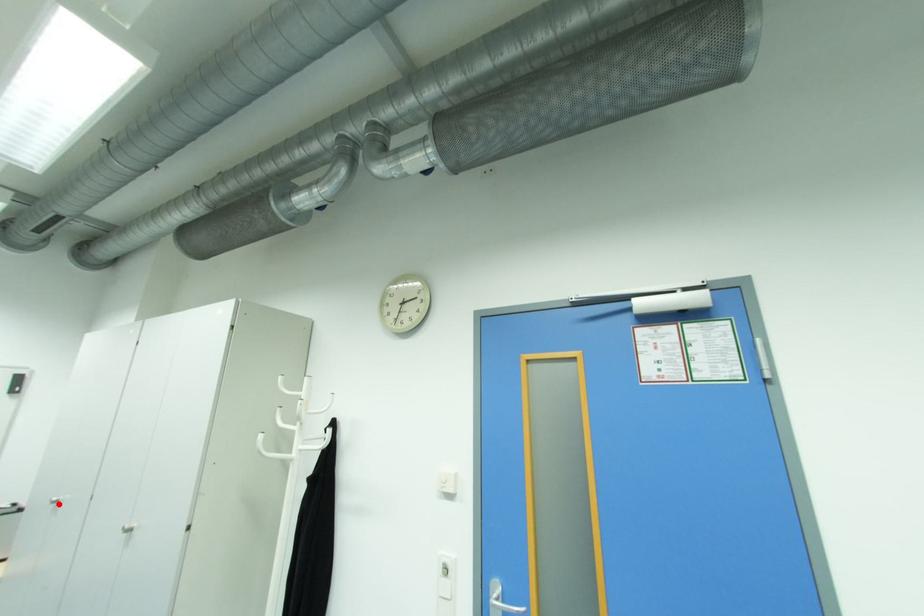
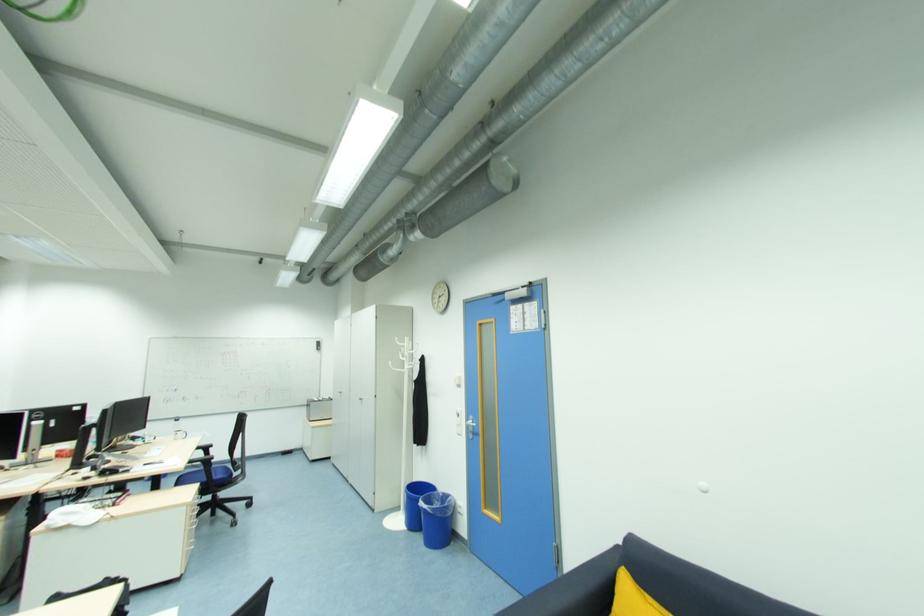
Find the pixel in the second image that matches the highlighted location in the first image.

(344, 394)